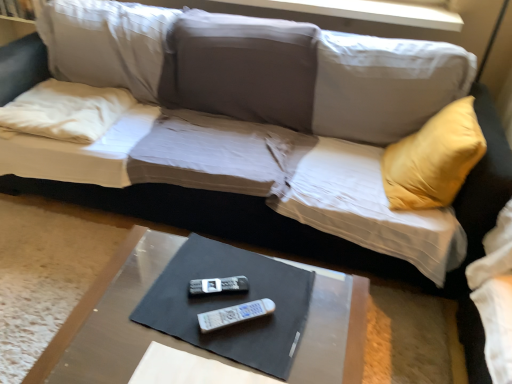
The width and height of the screenshot is (512, 384). Identify the location of vacant area located to the right-hand side of white plastic remote at center, positioned as the 2th remote in top-to-bottom order. (301, 323).